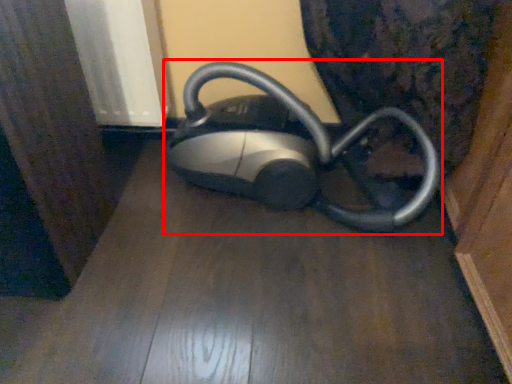
Question: From the image's perspective, what is the correct spatial positioning of home appliance (annotated by the red box) in reference to surface?

Choices:
 (A) below
 (B) above

Answer: (B)